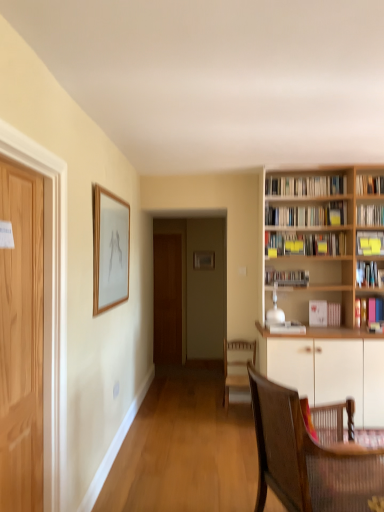
Question: Is matte black bookshelf at center, the 4th book in the bottom-to-top sequence, shorter than matte wooden picture frame at upper left?

Choices:
 (A) yes
 (B) no

Answer: (A)

Question: Is matte black bookshelf at center, which is the 6th book from top to bottom, behind matte wooden picture frame at upper left?

Choices:
 (A) no
 (B) yes

Answer: (B)

Question: From the image's perspective, is matte black bookshelf at center, which is the 6th book from top to bottom, located beneath matte wooden picture frame at upper left?

Choices:
 (A) no
 (B) yes

Answer: (B)

Question: Is matte black bookshelf at center, the 4th book in the bottom-to-top sequence, next to matte wooden picture frame at upper left and touching it?

Choices:
 (A) yes
 (B) no

Answer: (B)

Question: Can you confirm if matte black bookshelf at center, the 4th book in the bottom-to-top sequence, is taller than matte wooden picture frame at upper left?

Choices:
 (A) no
 (B) yes

Answer: (A)

Question: Does matte black bookshelf at center, which is the 6th book from top to bottom, contain matte wooden picture frame at upper left?

Choices:
 (A) yes
 (B) no

Answer: (B)

Question: From a real-world perspective, is white paper bookshelf at right, the 7th book when ordered from bottom to top, located higher than hardcover book at upper right, which is the 1th book from top to bottom?

Choices:
 (A) yes
 (B) no

Answer: (B)

Question: Does white paper bookshelf at right, the 7th book when ordered from bottom to top, appear on the right side of hardcover book at upper right, the 9th book from the bottom?

Choices:
 (A) yes
 (B) no

Answer: (B)

Question: Does white paper bookshelf at right, the 7th book when ordered from bottom to top, appear on the left side of hardcover book at upper right, the 9th book from the bottom?

Choices:
 (A) no
 (B) yes

Answer: (B)

Question: Is white paper bookshelf at right, acting as the third book starting from the top, with hardcover book at upper right, the 9th book from the bottom?

Choices:
 (A) yes
 (B) no

Answer: (B)

Question: From a real-world perspective, is white paper bookshelf at right, acting as the third book starting from the top, beneath hardcover book at upper right, which is the 1th book from top to bottom?

Choices:
 (A) yes
 (B) no

Answer: (A)

Question: Is white paper bookshelf at right, the 7th book when ordered from bottom to top, behind hardcover book at upper right, the 9th book from the bottom?

Choices:
 (A) yes
 (B) no

Answer: (B)

Question: Can you confirm if white paper book at right, which is the 8th book from top to bottom, is positioned to the right of brown woven chair at lower right, the 1th chair viewed from the front?

Choices:
 (A) no
 (B) yes

Answer: (B)